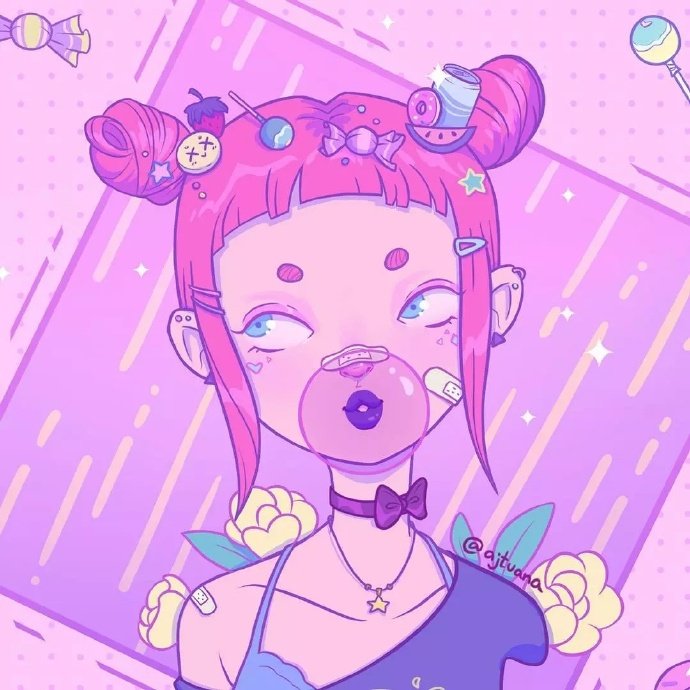
The image size is (690, 690). I want to click on makeup, so click(x=370, y=420), click(x=430, y=279), click(x=283, y=308), click(x=263, y=345), click(x=433, y=324), click(x=404, y=253), click(x=286, y=270).